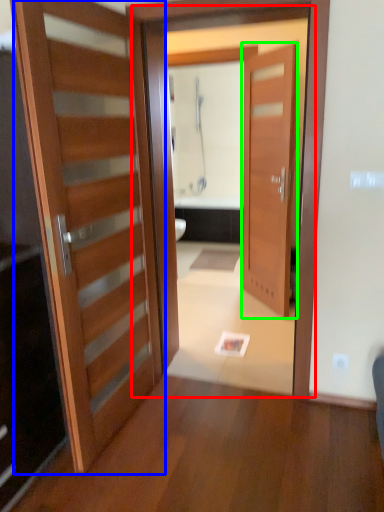
Question: Estimate the real-world distances between objects in this image. Which object is farther from screen door (highlighted by a red box), door (highlighted by a blue box) or door (highlighted by a green box)?

Choices:
 (A) door
 (B) door

Answer: (B)